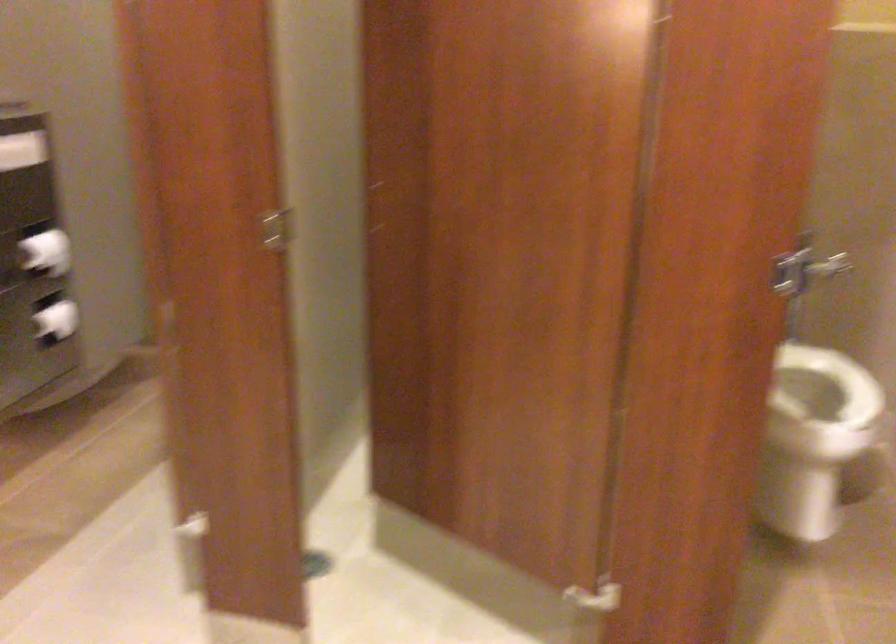
Find where to lift the white toilet seat. Please return your answer as a coordinate pair (x, y).

(811, 393)